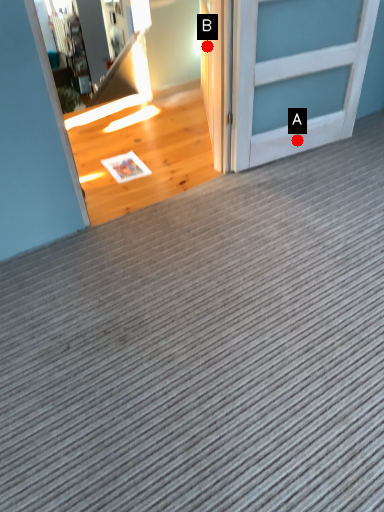
Question: Two points are circled on the image, labeled by A and B beside each circle. Which point is further to the camera?

Choices:
 (A) A is further
 (B) B is further

Answer: (A)